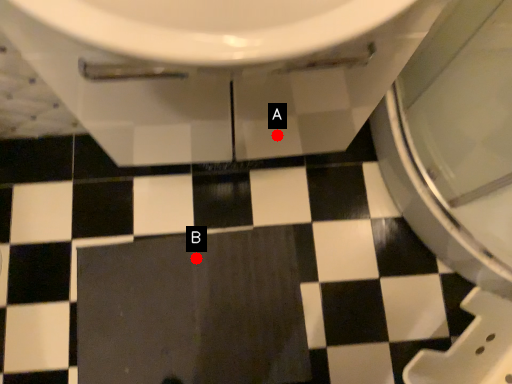
Question: Two points are circled on the image, labeled by A and B beside each circle. Among these points, which one is nearest to the camera?

Choices:
 (A) A is closer
 (B) B is closer

Answer: (A)